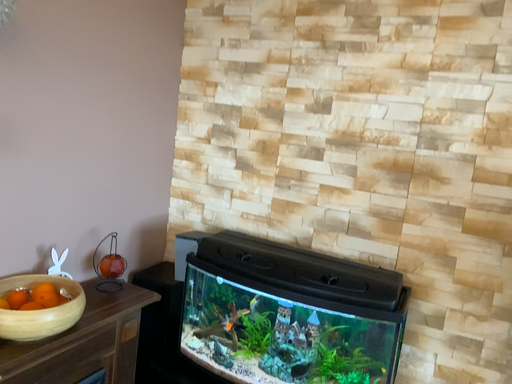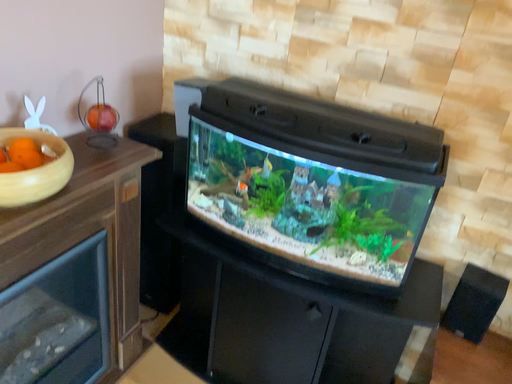
Question: How did the camera likely rotate when shooting the video?

Choices:
 (A) rotated downward
 (B) rotated upward

Answer: (A)